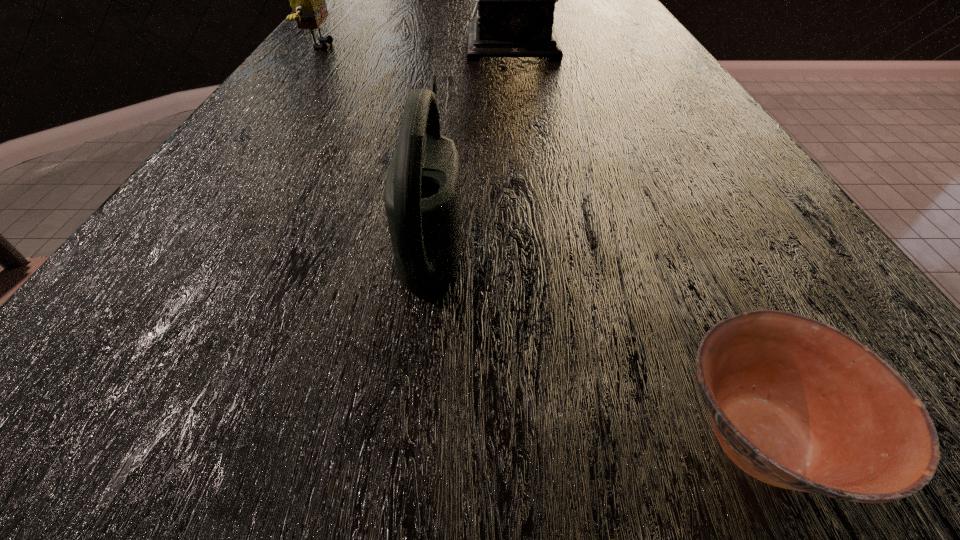
At what (x,y) coordinates should I click in order to perform the action: click on vacant space that is in between the sponge and the bowl. Please return your answer as a coordinate pair (x, y). The height and width of the screenshot is (540, 960). Looking at the image, I should click on (541, 242).

Where is `vacant space in between the watering can and the tallest object`? This screenshot has height=540, width=960. vacant space in between the watering can and the tallest object is located at coordinates (478, 138).

Locate an element on the screen. Image resolution: width=960 pixels, height=540 pixels. free area in between the tallest object and the leftmost object is located at coordinates (422, 45).

Where is `free space that is in between the sponge and the third farthest object`? Image resolution: width=960 pixels, height=540 pixels. free space that is in between the sponge and the third farthest object is located at coordinates (377, 139).

You are a GUI agent. You are given a task and a screenshot of the screen. Output one action in this format:
    pyautogui.click(x=<x>, y=<y>)
    Task: Click on the vacant space in between the leftmost object and the second nearest object
    
    Given the screenshot: What is the action you would take?
    pyautogui.click(x=377, y=139)

Locate an element on the screen. This screenshot has width=960, height=540. free area in between the leftmost object and the nearest object is located at coordinates (541, 242).

Where is `free area in between the nearest object and the tallest object`? free area in between the nearest object and the tallest object is located at coordinates (642, 241).

I want to click on object that ranks as the second closest to the sponge, so click(x=421, y=196).

Locate which object ranks second in proximity to the tallest object. Please provide its 2D coordinates. Your answer should be formatted as a tuple, i.e. [(x, y)], where the tuple contains the x and y coordinates of a point satisfying the conditions above.

[(421, 196)]

Locate an element on the screen. vacant space that satisfies the following two spatial constraints: 1. on the back side of the shortest object; 2. on the spout of the watering can is located at coordinates (667, 232).